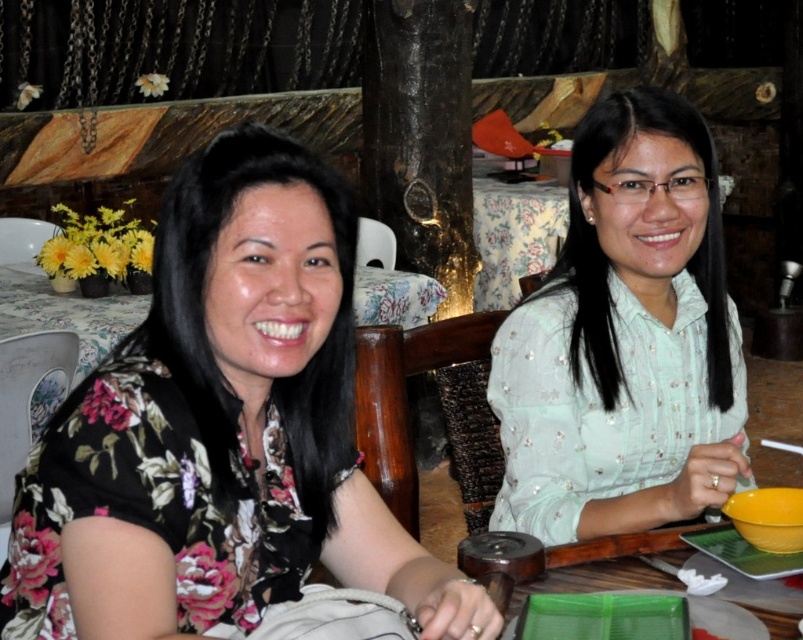
You are a server in a rustic restaurant and need to place a new drink order for the two women seated at the floral fabric table at center and the green plastic tray at lower right. Which object should you place the drink on to ensure it is at a comfortable height for the customers?

The floral fabric table at center is much taller than the green plastic tray at lower right, so placing the drink on the floral fabric table at center would be at a comfortable height for the customers.

Consider the image. You are standing in a rustic restaurant and want to place a small vase exactly at point (549,557). Considering the table is 4 feet wide, will the vase fit on the table?

The distance between point (549,557) and the viewer is 3.35 feet, but the table is 4 feet wide. Since the distance from the viewer to the point is less than the table width, the vase will fit on the table.

You are a photographer trying to capture a photo of both women at the table. You notice two points marked in the scene. The first point is at coordinates point (x=477, y=304) and the second is at point (x=563, y=566). Which point should you focus on to ensure both women are in the frame?

Point (x=563, y=566) should be focused on because it is in front of point (x=477, y=304), allowing both women to be captured within the frame.